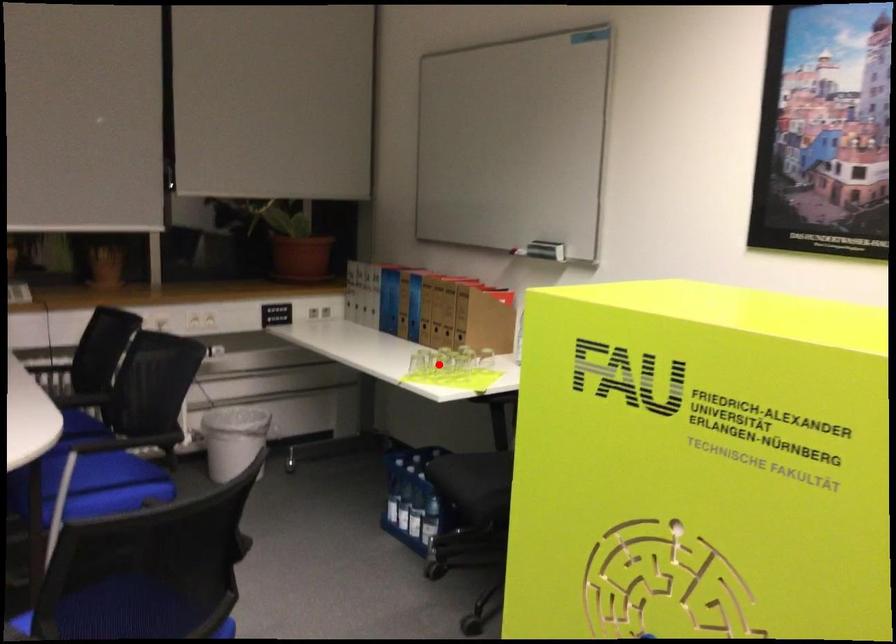
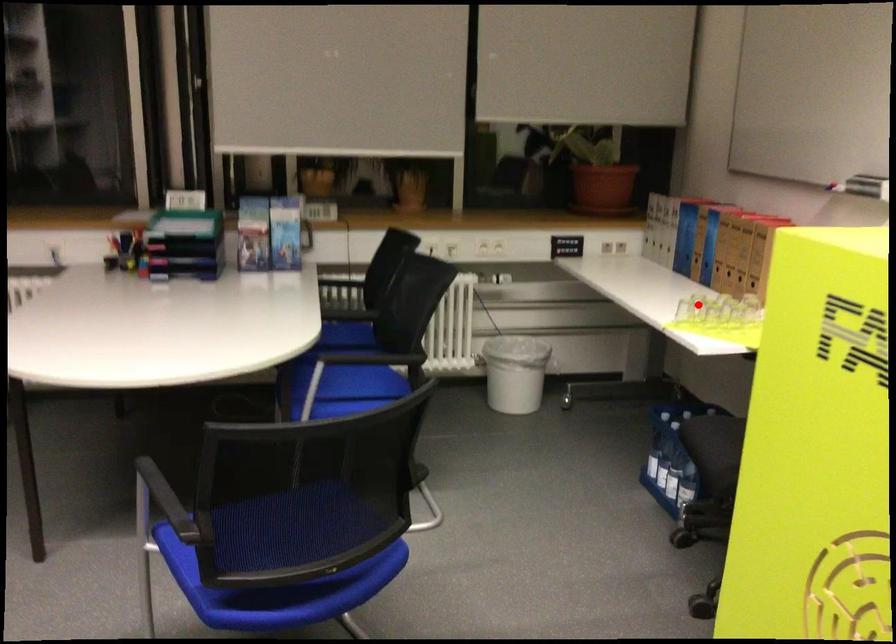
I am providing you with two images of the same scene from different viewpoints. A red point is marked on the first image and another point is marked on the second image. Does the point marked in image1 correspond to the same location as the one in image2?

No